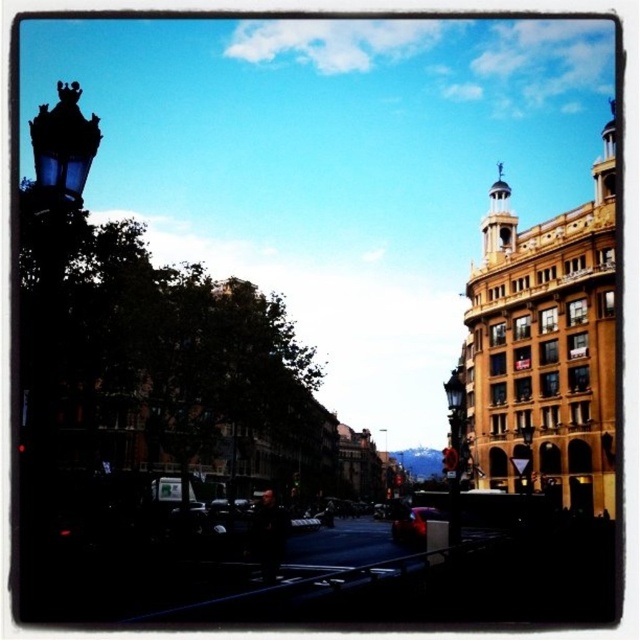
Can you confirm if matte black street light at center is bigger than glossy red car at center?

Correct, matte black street light at center is larger in size than glossy red car at center.

Identify the location of matte black street light at center. (454, 451).

Is point (451, 436) closer to camera compared to point (413, 518)?

No, (451, 436) is behind (413, 518).

Image resolution: width=640 pixels, height=640 pixels. What are the coordinates of `matte black street light at center` in the screenshot? It's located at (454, 451).

Which is in front, point (448, 452) or point (387, 442)?

Positioned in front is point (448, 452).

How distant is matte black street light at center from metallic street light at center?

A distance of 71.99 feet exists between matte black street light at center and metallic street light at center.

Who is more distant from viewer, (451, 538) or (387, 474)?

The point (387, 474) is more distant.

The height and width of the screenshot is (640, 640). What are the coordinates of `matte black street light at center` in the screenshot? It's located at (454, 451).

Between black glass street light at center and metallic street light at center, which one has more height?

metallic street light at center is taller.

At what (x,y) coordinates should I click in order to perform the action: click on black glass street light at center. Please return your answer as a coordinate pair (x, y). This screenshot has height=640, width=640. Looking at the image, I should click on (528, 458).

At what (x,y) coordinates should I click in order to perform the action: click on black glass street light at center. Please return your answer as a coordinate pair (x, y). The width and height of the screenshot is (640, 640). Looking at the image, I should click on (528, 458).